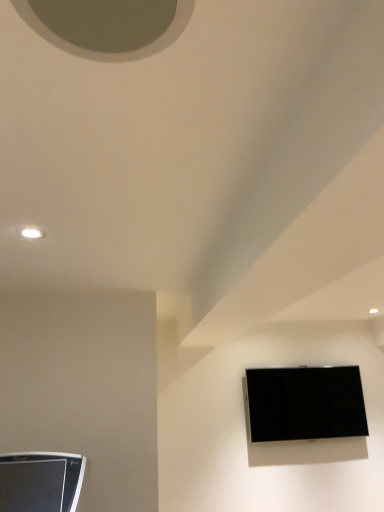
What is the approximate height of black glossy tv at lower right?

black glossy tv at lower right is 21.47 inches tall.

The height and width of the screenshot is (512, 384). I want to click on black glossy tv at lower right, so click(305, 403).

What do you see at coordinates (305, 403) in the screenshot? The width and height of the screenshot is (384, 512). I see `black glossy tv at lower right` at bounding box center [305, 403].

Find the location of `black glossy tv at lower right`. black glossy tv at lower right is located at coordinates (305, 403).